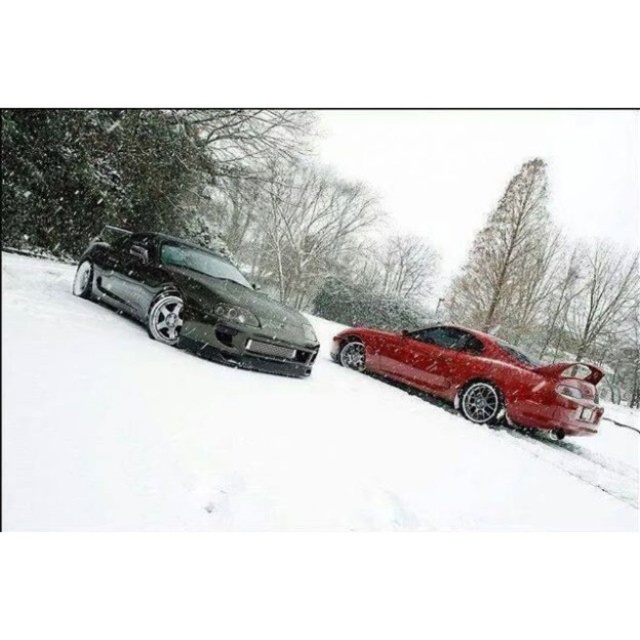
Is satin black car at center to the left of glossy red car at right from the viewer's perspective?

Indeed, satin black car at center is positioned on the left side of glossy red car at right.

From the picture: Is satin black car at center behind glossy red car at right?

No, satin black car at center is closer to the viewer.

At what (x,y) coordinates should I click in order to perform the action: click on satin black car at center. Please return your answer as a coordinate pair (x, y). Looking at the image, I should click on (259, 440).

The height and width of the screenshot is (640, 640). What are the coordinates of `shiny black car at left` in the screenshot? It's located at (193, 300).

Is point (180, 332) positioned in front of point (429, 326)?

Yes, it is in front of point (429, 326).

Where is `shiny black car at left`? shiny black car at left is located at coordinates (193, 300).

Which is above, satin black car at center or shiny black car at left?

shiny black car at left is above.

Which is in front, point (92, 508) or point (205, 346)?

Positioned in front is point (92, 508).

Does point (147, 528) come farther from viewer compared to point (145, 252)?

That is False.

This screenshot has height=640, width=640. I want to click on satin black car at center, so click(259, 440).